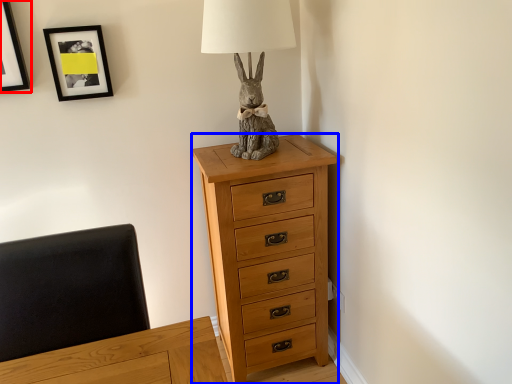
Question: Among these objects, which one is nearest to the camera, picture frame (highlighted by a red box) or chest of drawers (highlighted by a blue box)?

Choices:
 (A) picture frame
 (B) chest of drawers

Answer: (A)